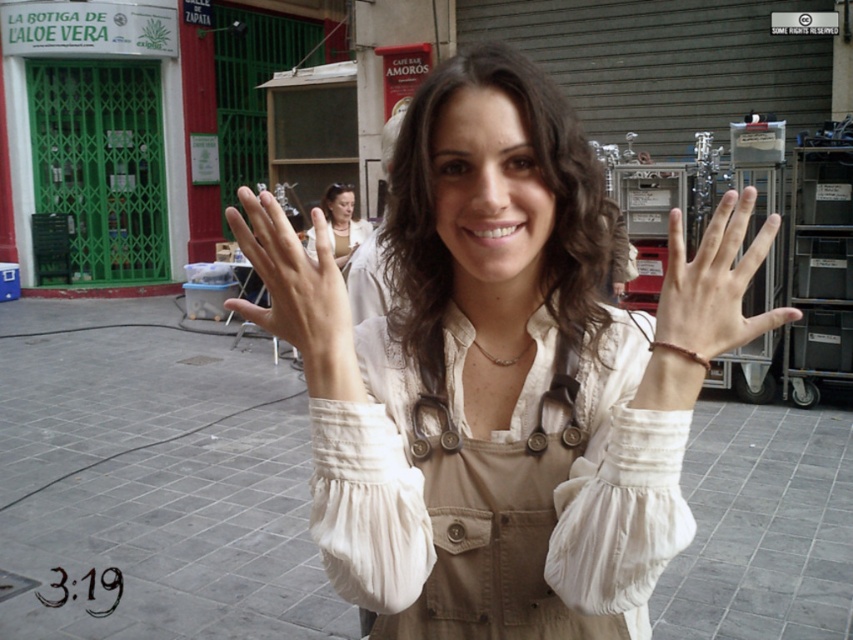
Question: Among these objects, which one is nearest to the camera?

Choices:
 (A) smooth beige hand at center
 (B) matte white dress at center
 (C) pearl necklace at center
 (D) white cotton shirt at center

Answer: (A)

Question: Can you confirm if smooth beige hand at center is positioned to the right of pearl necklace at center?

Choices:
 (A) no
 (B) yes

Answer: (B)

Question: Which of the following is the closest to the observer?

Choices:
 (A) (762, 324)
 (B) (354, 481)
 (C) (389, 260)

Answer: (A)

Question: Does white cotton shirt at center appear over smooth skin hand at center?

Choices:
 (A) no
 (B) yes

Answer: (A)

Question: Which point is closer to the camera taking this photo?

Choices:
 (A) (746, 340)
 (B) (349, 252)
 (C) (422, 573)
 (D) (343, 221)

Answer: (A)

Question: Observing the image, what is the correct spatial positioning of beige cotton jumpsuit at center in reference to pearl necklace at center?

Choices:
 (A) below
 (B) above

Answer: (A)